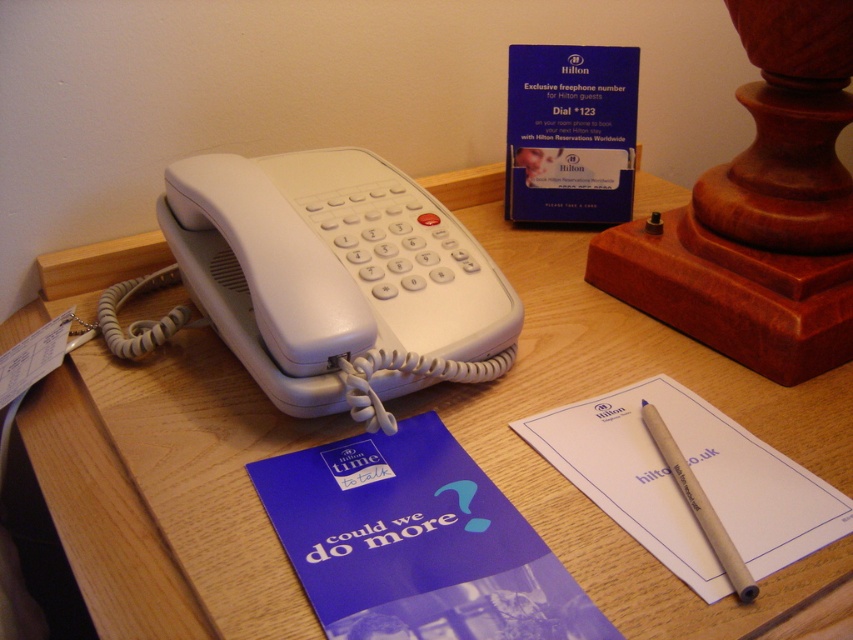
Question: Can you confirm if white paper at center is bigger than blue wood pen at center?

Choices:
 (A) yes
 (B) no

Answer: (A)

Question: Is blue paper at center smaller than blue wood pen at center?

Choices:
 (A) yes
 (B) no

Answer: (B)

Question: Which point is closer to the camera taking this photo?

Choices:
 (A) (621, 468)
 (B) (436, 560)

Answer: (B)

Question: Which object is positioned farthest from the blue wood pen at center?

Choices:
 (A) white paper at center
 (B) blue paper at center

Answer: (B)

Question: Does blue paper at center appear on the right side of white paper at center?

Choices:
 (A) yes
 (B) no

Answer: (B)

Question: Which of the following is the farthest from the observer?

Choices:
 (A) (753, 589)
 (B) (260, 477)
 (C) (700, 573)

Answer: (B)